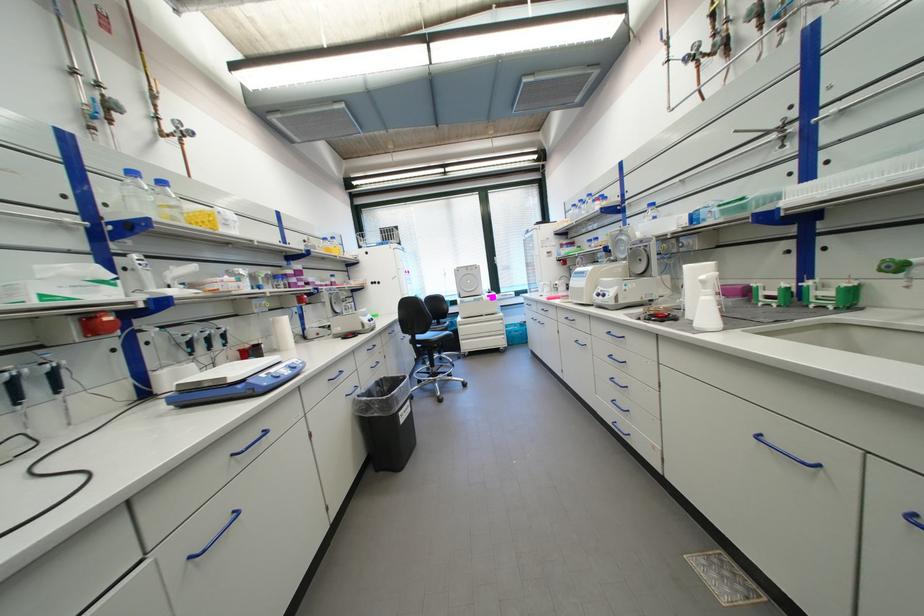
The height and width of the screenshot is (616, 924). In order to click on black chair sitting surface in this screenshot , I will do `click(442, 338)`.